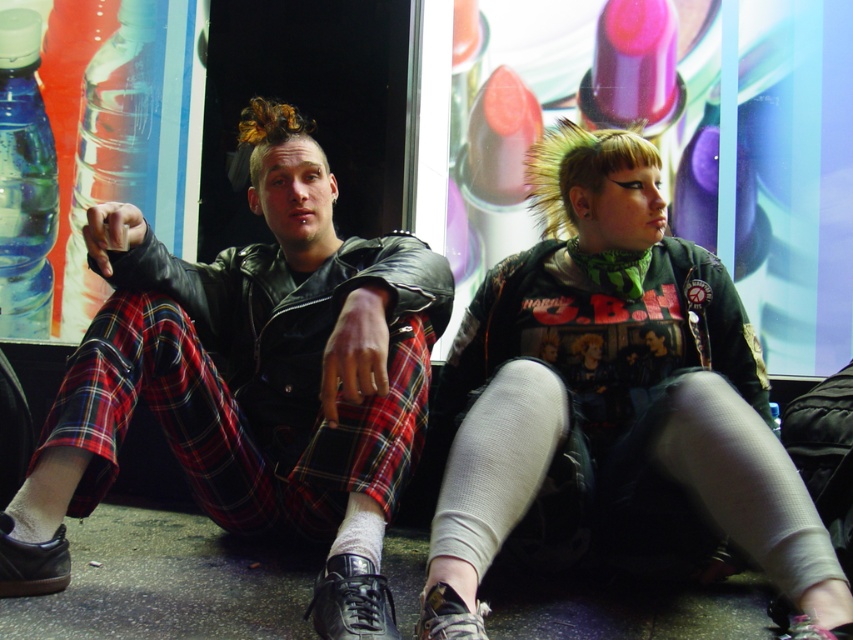
In the scene shown: You are a photographer setting up a shoot in this scene. You need to place a small tripod between the leather jacket at center and the clear plastic bottle at left. Since the tripod requires at least 30 cm of space between the two objects, will there be enough room?

The leather jacket at center is shorter than the clear plastic bottle at left, but this detail does not provide information about the distance between them. Without knowing the actual spacing, it is impossible to determine if there is enough room for the tripod.

You are a photographer setting up a shoot in this scene. You need to place a light source above the clear plastic bottle at left to highlight it. Will the light source also illuminate the leather jacket at center?

The leather jacket at center is below the clear plastic bottle at left, so placing a light source above the bottle would cast light downward, illuminating both the bottle and the jacket beneath it.